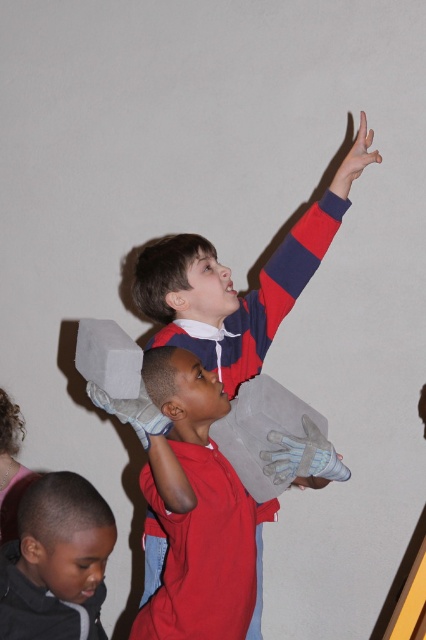
Question: Does matte gray cube at upper center appear on the left side of white mesh glove at upper right?

Choices:
 (A) yes
 (B) no

Answer: (A)

Question: Is black matte jacket at lower left positioned behind matte red and blue striped sleeve at upper right?

Choices:
 (A) yes
 (B) no

Answer: (B)

Question: Observing the image, what is the correct spatial positioning of matte gray cube at upper center in reference to matte red and blue striped sleeve at upper right?

Choices:
 (A) above
 (B) below

Answer: (B)

Question: Which point is farther from the camera taking this photo?

Choices:
 (A) (365, 154)
 (B) (311, 458)

Answer: (A)

Question: Among these objects, which one is farthest from the camera?

Choices:
 (A) white mesh glove at upper right
 (B) matte red and blue striped sleeve at upper right

Answer: (B)

Question: Among these objects, which one is farthest from the camera?

Choices:
 (A) black matte jacket at lower left
 (B) smooth skin hand at upper right

Answer: (B)